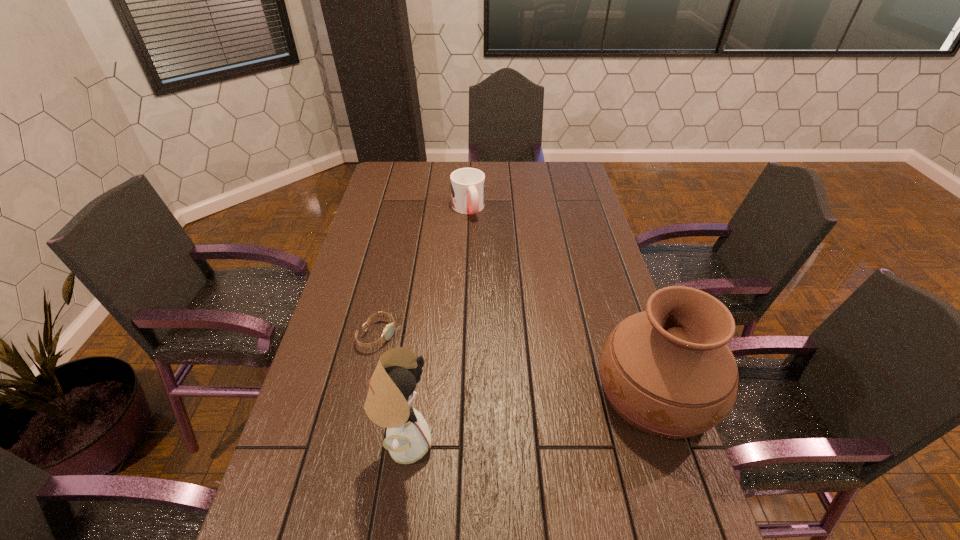
At what (x,y) coordinates should I click in order to perform the action: click on free spot on the desktop that is between the doll and the urn and is positioned on the side of the second shortest object with the handle. Please return your answer as a coordinate pair (x, y). This screenshot has width=960, height=540. Looking at the image, I should click on (557, 411).

I want to click on vacant spot on the desktop that is between the doll and the rightmost object and is positioned on the face of the watch, so click(x=559, y=411).